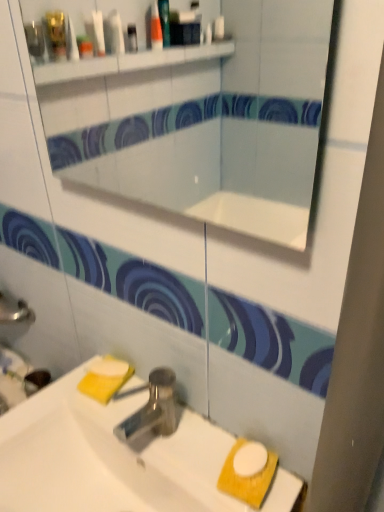
Question: Considering the relative positions of white glossy mirror at upper center and polished metallic tap at center in the image provided, is white glossy mirror at upper center to the left or to the right of polished metallic tap at center?

Choices:
 (A) right
 (B) left

Answer: (A)

Question: From a real-world perspective, relative to polished metallic tap at center, is white glossy mirror at upper center vertically above or below?

Choices:
 (A) below
 (B) above

Answer: (B)

Question: Which is nearer to the polished metallic tap at center?

Choices:
 (A) white glossy sink at lower center
 (B) white matte soap at lower center
 (C) white glossy mirror at upper center

Answer: (A)

Question: Which object is positioned closest to the white glossy mirror at upper center?

Choices:
 (A) polished metallic tap at center
 (B) white glossy sink at lower center
 (C) white matte soap at lower center

Answer: (B)